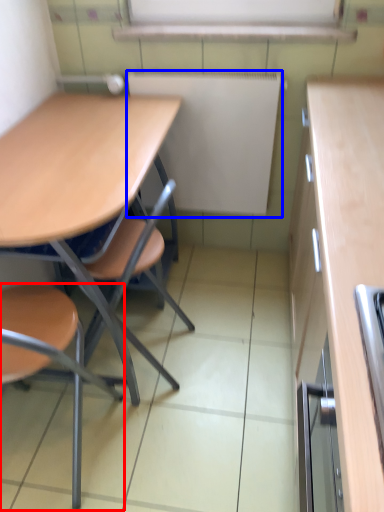
Question: Which object appears farthest to the camera in this image, chair (highlighted by a red box) or bulletin board (highlighted by a blue box)?

Choices:
 (A) chair
 (B) bulletin board

Answer: (B)